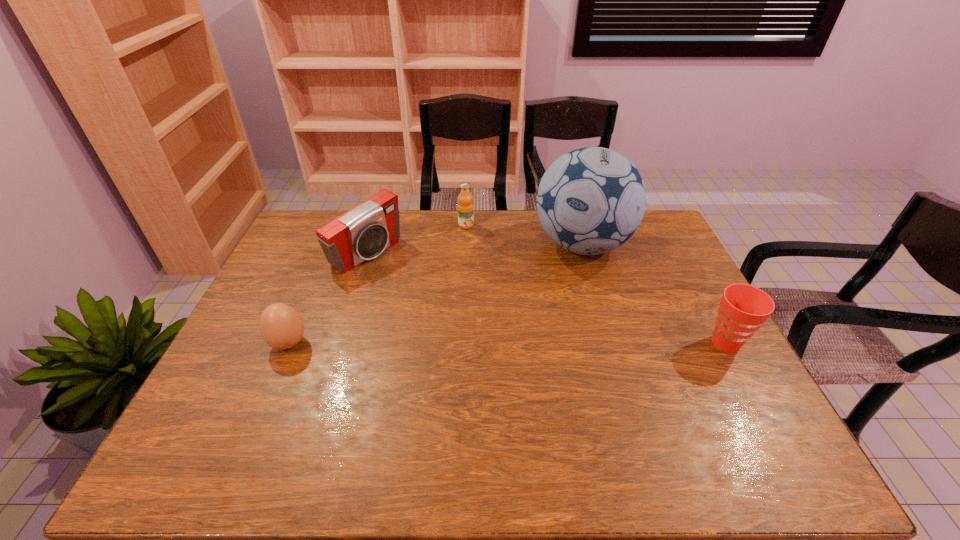
Find the location of a particular element. The width and height of the screenshot is (960, 540). the shortest object is located at coordinates (281, 326).

Where is `the rightmost object`? The width and height of the screenshot is (960, 540). the rightmost object is located at coordinates (743, 308).

In order to click on camera in this screenshot , I will do `click(365, 231)`.

Find the location of `soccer ball`. soccer ball is located at coordinates (590, 201).

The image size is (960, 540). I want to click on the tallest object, so click(590, 201).

This screenshot has width=960, height=540. I want to click on the third object from left to right, so click(x=465, y=206).

Find the location of a particular element. vacant space located on the front of the shortest object is located at coordinates tap(262, 405).

You are a GUI agent. You are given a task and a screenshot of the screen. Output one action in this format:
    pyautogui.click(x=<x>, y=<y>)
    Task: Click on the free space located on the left of the cup
    This screenshot has height=540, width=960.
    Given the screenshot: What is the action you would take?
    pyautogui.click(x=557, y=343)

Locate an element on the screen. Image resolution: width=960 pixels, height=540 pixels. free point located 0.390m on the front-facing side of the camera is located at coordinates (476, 330).

The height and width of the screenshot is (540, 960). In order to click on blank space located 0.180m on the front-facing side of the camera in this screenshot , I will do `click(425, 295)`.